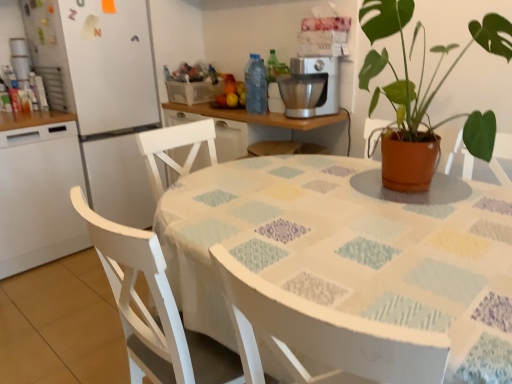
Question: Is transparent plastic bottle at center directly adjacent to white glossy refrigerator at left?

Choices:
 (A) yes
 (B) no

Answer: (B)

Question: Can you confirm if transparent plastic bottle at center is thinner than white glossy refrigerator at left?

Choices:
 (A) yes
 (B) no

Answer: (A)

Question: Does transparent plastic bottle at center have a greater width compared to white glossy refrigerator at left?

Choices:
 (A) no
 (B) yes

Answer: (A)

Question: Is transparent plastic bottle at center smaller than white glossy refrigerator at left?

Choices:
 (A) yes
 (B) no

Answer: (A)

Question: Is transparent plastic bottle at center in front of white glossy refrigerator at left?

Choices:
 (A) no
 (B) yes

Answer: (A)

Question: From the image's perspective, relative to white wood chair at lower left, is terracotta pot at upper right above or below?

Choices:
 (A) above
 (B) below

Answer: (A)

Question: Is terracotta pot at upper right taller or shorter than white wood chair at lower left?

Choices:
 (A) tall
 (B) short

Answer: (B)

Question: Is terracotta pot at upper right to the left or to the right of white wood chair at lower left in the image?

Choices:
 (A) right
 (B) left

Answer: (A)

Question: Is point (381, 170) positioned closer to the camera than point (240, 362)?

Choices:
 (A) farther
 (B) closer

Answer: (A)

Question: Would you say terracotta pot at upper right is inside or outside white glossy refrigerator at left?

Choices:
 (A) inside
 (B) outside

Answer: (B)

Question: From a real-world perspective, is terracotta pot at upper right above or below white glossy refrigerator at left?

Choices:
 (A) below
 (B) above

Answer: (B)

Question: Is point (368, 23) positioned closer to the camera than point (60, 150)?

Choices:
 (A) farther
 (B) closer

Answer: (B)

Question: From the image's perspective, is terracotta pot at upper right positioned above or below white glossy refrigerator at left?

Choices:
 (A) below
 (B) above

Answer: (B)

Question: From a real-world perspective, is white wood chair at lower left physically located above or below terracotta pot at upper right?

Choices:
 (A) below
 (B) above

Answer: (A)

Question: Considering the positions of white wood chair at lower left and terracotta pot at upper right in the image, is white wood chair at lower left taller or shorter than terracotta pot at upper right?

Choices:
 (A) short
 (B) tall

Answer: (B)